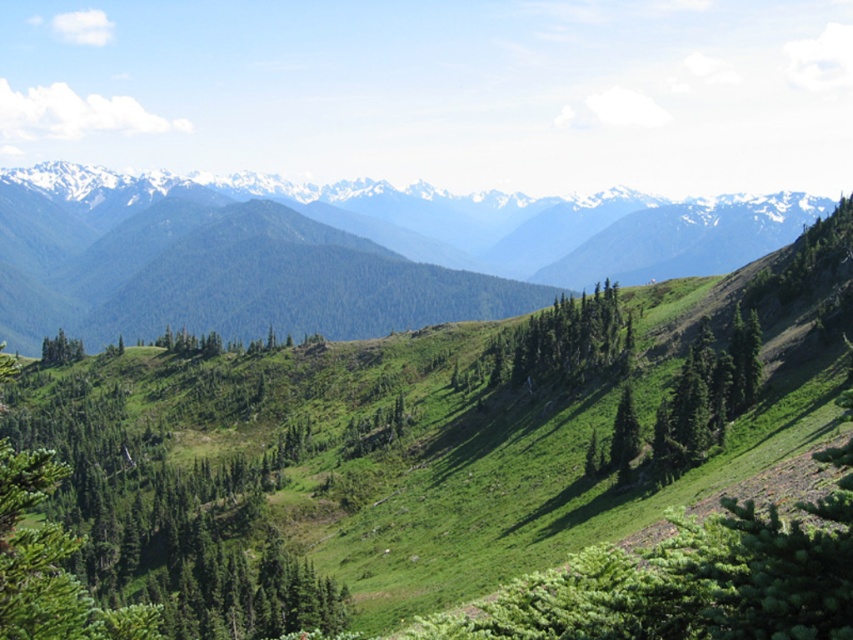
Question: Based on their relative distances, which object is farther from the green leafy trees at center?

Choices:
 (A) green grassy hillside at center
 (B) green matte tree at center
 (C) green leafy tree at center
 (D) green matte tree at lower left

Answer: (A)

Question: Which point appears closest to the camera in this image?

Choices:
 (A) (508, 356)
 (B) (45, 337)
 (C) (732, 376)

Answer: (C)

Question: Does green grassy hillside at center come in front of green matte tree at center?

Choices:
 (A) yes
 (B) no

Answer: (B)

Question: Is green leafy trees at center to the right of green matte tree at lower left from the viewer's perspective?

Choices:
 (A) no
 (B) yes

Answer: (B)

Question: Can you confirm if green leafy tree at center is smaller than green matte tree at center?

Choices:
 (A) no
 (B) yes

Answer: (A)

Question: Which of the following is the farthest from the observer?

Choices:
 (A) green leafy trees at center
 (B) green matte tree at lower left
 (C) green grassy hillside at center
 (D) green leafy tree at center

Answer: (B)